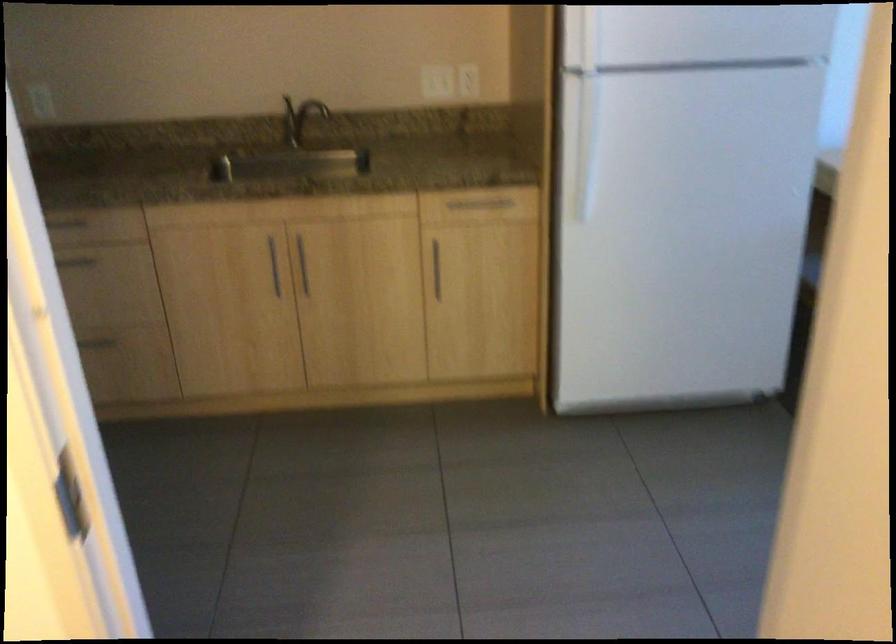
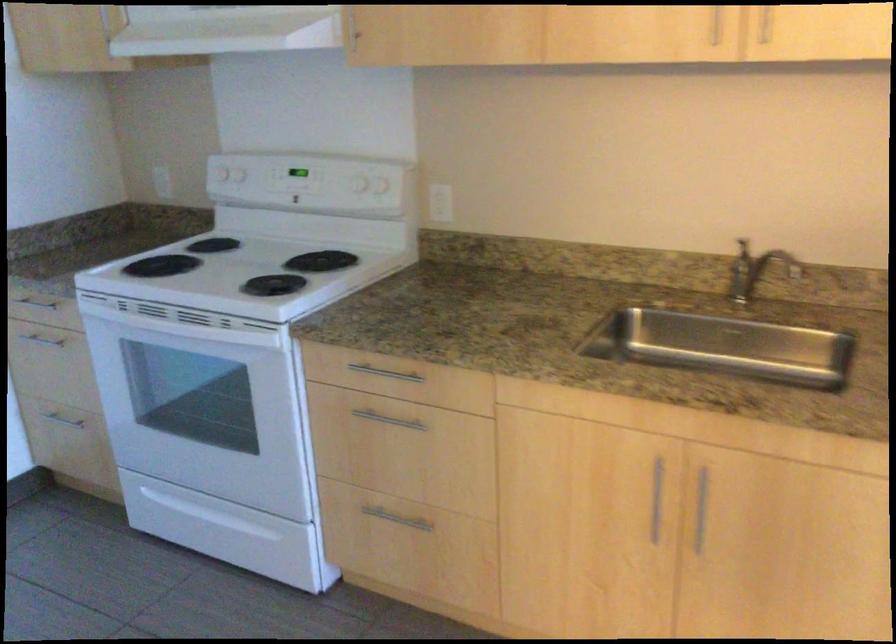
Question: How did the camera likely rotate?

Choices:
 (A) Left
 (B) Right
 (C) Up
 (D) Down

Answer: (A)